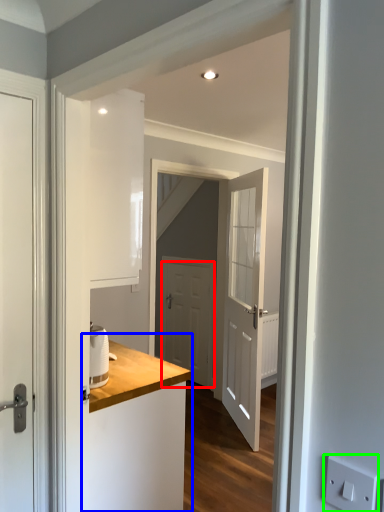
Question: Which object is the closest to the door (highlighted by a red box)? Choose among these: counter (highlighted by a blue box) or electric outlet (highlighted by a green box).

Choices:
 (A) counter
 (B) electric outlet

Answer: (A)